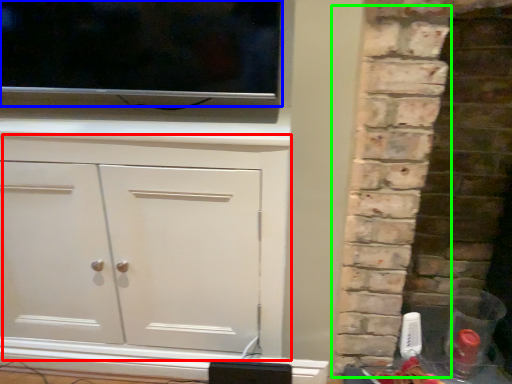
Question: Considering the real-world distances, which object is closest to cupboard (highlighted by a red box)? tv show (highlighted by a blue box) or brickwork (highlighted by a green box).

Choices:
 (A) tv show
 (B) brickwork

Answer: (A)